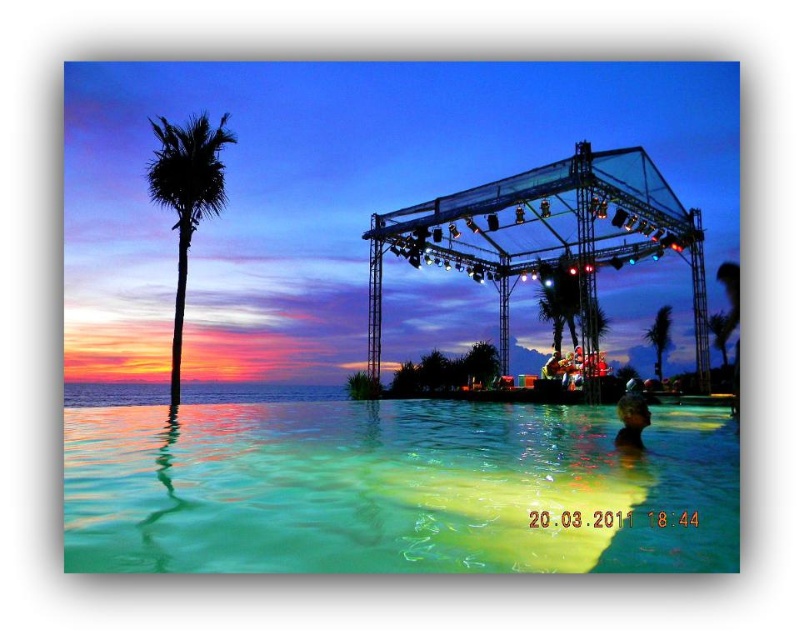
You are standing at the edge of the infinity pool and want to walk towards the two points marked in the image. Which point, point (224, 186) or point (622, 397), is closer to you?

Point (224, 186) is closer to you because it is further to the viewer than point (622, 397).

You are a photographer trying to capture the sunset reflection in the infinity pool. You notice the black silhouette palm tree at left and the smooth skin head at lower right in your shot. Which object is positioned higher in the frame?

The black silhouette palm tree at left is positioned higher in the frame than the smooth skin head at lower right.